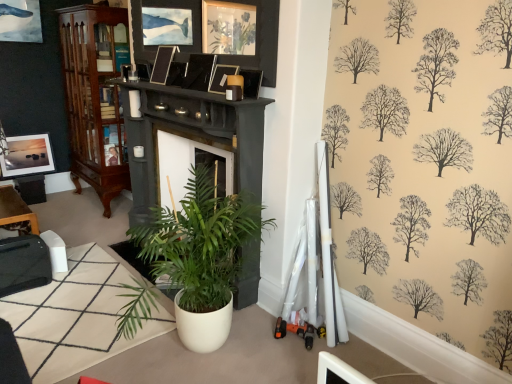
Question: In the image, is white matte houseplant at center positioned in front of or behind brown wood cabinet at left?

Choices:
 (A) front
 (B) behind

Answer: (A)

Question: From the image's perspective, relative to brown wood cabinet at left, is white matte houseplant at center above or below?

Choices:
 (A) below
 (B) above

Answer: (A)

Question: Which object is the farthest from the satin black picture frame at upper center, arranged as the 4th picture frame when viewed from the front?

Choices:
 (A) white matte houseplant at center
 (B) matte black picture frame at upper center, the 3th picture frame viewed from the back
 (C) matte black picture frame at upper center, the fifth picture frame positioned from the back
 (D) matte silver picture frame at upper left, which ranks as the first picture frame in left-to-right order
 (E) white matte rug at lower left

Answer: (D)

Question: Estimate the real-world distances between objects in this image. Which object is farther from the black glossy picture frame at upper center, the 2th picture frame viewed from the right?

Choices:
 (A) brown wood cabinet at left
 (B) matte black picture frame at upper center, positioned as the third picture frame in front-to-back order
 (C) white matte houseplant at center
 (D) matte silver picture frame at upper left, the 5th picture frame in the front-to-back sequence
 (E) satin black picture frame at upper center, which is the fourth picture frame in right-to-left order

Answer: (D)